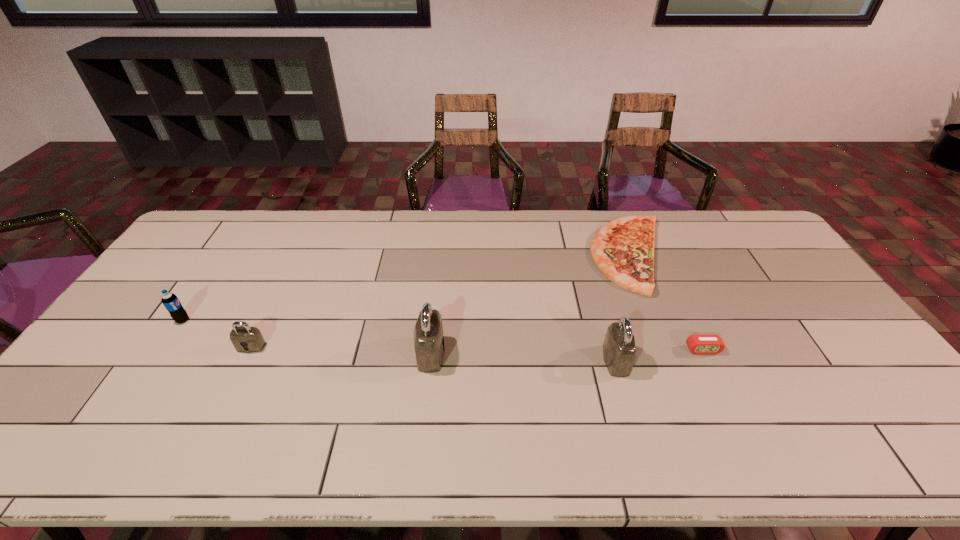
This screenshot has height=540, width=960. Find the location of `free space located at the front of the fourth object from right to left near the keyhole`. free space located at the front of the fourth object from right to left near the keyhole is located at coordinates (474, 353).

The image size is (960, 540). Identify the location of free spot located 0.310m at the front of the rightmost padlock near the keyhole. (745, 360).

At what (x,y) coordinates should I click in order to perform the action: click on free space located 0.160m on the front of the farthest object. Please return your answer as a coordinate pair (x, y). Looking at the image, I should click on (664, 339).

Image resolution: width=960 pixels, height=540 pixels. What are the coordinates of `vacant space located on the back of the leftmost object` in the screenshot? It's located at tap(210, 279).

Identify the location of free space located on the front-facing side of the alarm clock. The image size is (960, 540). (715, 376).

Locate an element on the screen. The image size is (960, 540). object at the far edge is located at coordinates (623, 249).

Identify the location of object at the left edge. (171, 302).

At what (x,y) coordinates should I click in order to perform the action: click on vacant space at the far edge of the desktop. Please return your answer as a coordinate pair (x, y). The height and width of the screenshot is (540, 960). Looking at the image, I should click on (567, 221).

You are a GUI agent. You are given a task and a screenshot of the screen. Output one action in this format:
    pyautogui.click(x=<x>, y=<y>)
    Task: Click on the vacant space at the right edge of the desktop
    Image resolution: width=960 pixels, height=540 pixels.
    Given the screenshot: What is the action you would take?
    pyautogui.click(x=781, y=285)

In the image, there is a desktop. Find the location of `vacant space at the far left corner`. vacant space at the far left corner is located at coordinates (232, 238).